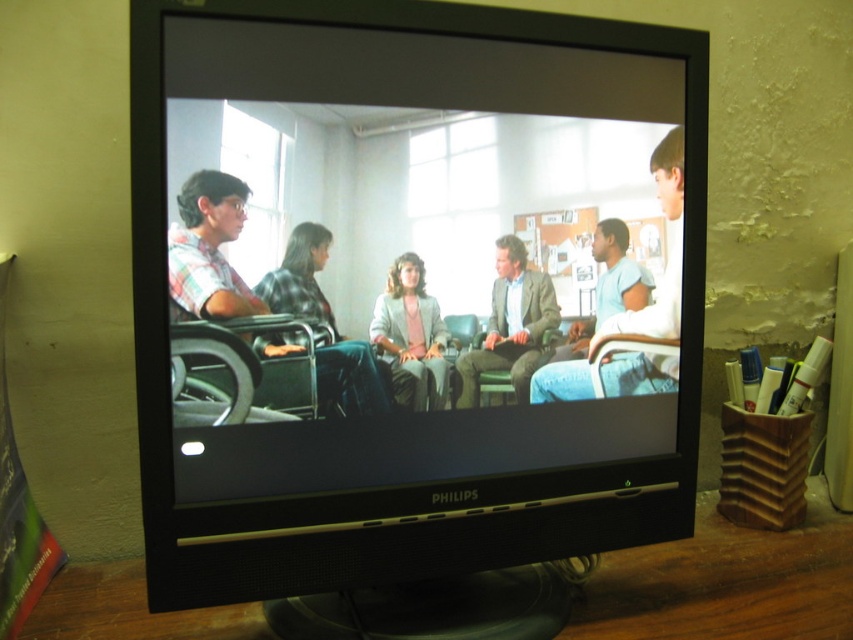
You are looking at the Philips CRT television and notice both the black plastic monitor at center and the plaid shirt at center. Which object is located to the left of the other?

The plaid shirt at center is to the left of the black plastic monitor at center because the black plastic monitor at center is positioned on the right side of plaid shirt at center.

In the scene shown: You are a caregiver who needs to move the plaid shirt at center to the closet. Can you move the metallic gray wheelchair at center first to make space?

The metallic gray wheelchair at center is bigger than plaid shirt at center, so moving the wheelchair first would be necessary to create enough space for the shirt.

You are standing in front of the Philips CRT television and want to place a black plastic monitor at center on the desk. The desk has a coordinate system where the bottom left corner is at point 0,0 and the top right corner is at 1,1. Where should you place the monitor to match the image?

The black plastic monitor at center should be placed at point (x=425, y=291) to match the image.